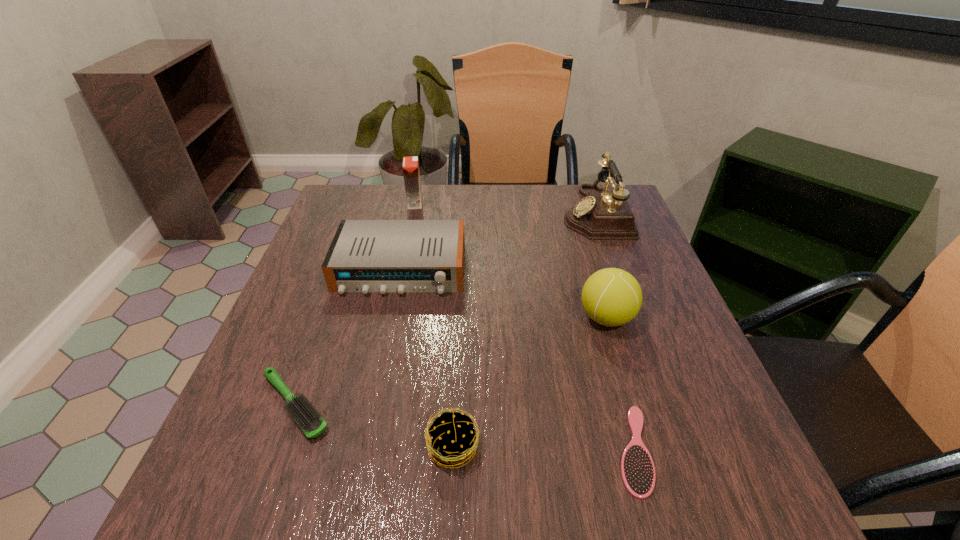
The image size is (960, 540). What are the coordinates of `empty location between the fourth farthest object and the radio receiver` in the screenshot? It's located at (503, 293).

Image resolution: width=960 pixels, height=540 pixels. I want to click on vacant area that lies between the fourth nearest object and the telephone, so click(x=600, y=265).

The height and width of the screenshot is (540, 960). In order to click on vacant space in between the radio receiver and the tennis ball in this screenshot , I will do `click(503, 293)`.

At what (x,y) coordinates should I click in order to perform the action: click on object that can be found as the fourth closest to the telephone. Please return your answer as a coordinate pair (x, y). Looking at the image, I should click on (638, 473).

The width and height of the screenshot is (960, 540). What are the coordinates of `object that is the fifth closest to the orange juice` in the screenshot? It's located at [459, 443].

Locate an element on the screen. The width and height of the screenshot is (960, 540). vacant region that satisfies the following two spatial constraints: 1. on the dial of the tallest object; 2. on the front side of the tennis ball is located at coordinates (632, 318).

Locate an element on the screen. free space that satisfies the following two spatial constraints: 1. on the front side of the patty; 2. on the left side of the orange juice is located at coordinates (364, 447).